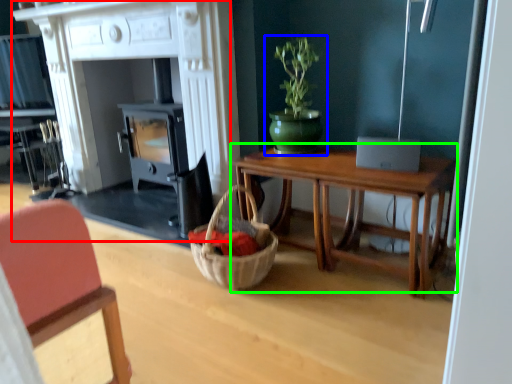
Question: Considering the real-world distances, which object is closest to fireplace (highlighted by a red box)? houseplant (highlighted by a blue box) or table (highlighted by a green box).

Choices:
 (A) houseplant
 (B) table

Answer: (A)